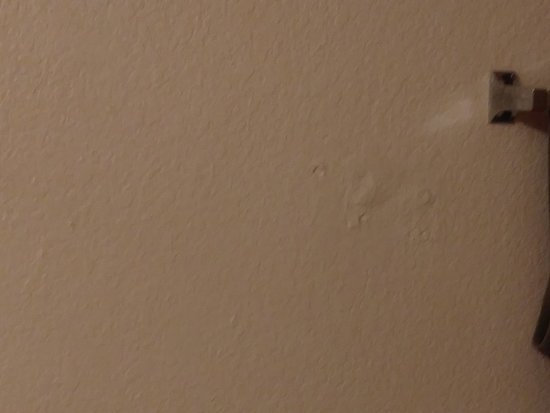
Where is `screws`? The image size is (550, 413). screws is located at coordinates (502, 115), (504, 76).